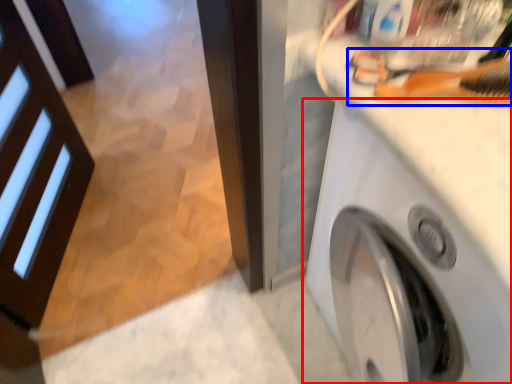
Question: Which of the following is the closest to the observer, washing machine (highlighted by a red box) or brush (highlighted by a blue box)?

Choices:
 (A) washing machine
 (B) brush

Answer: (A)